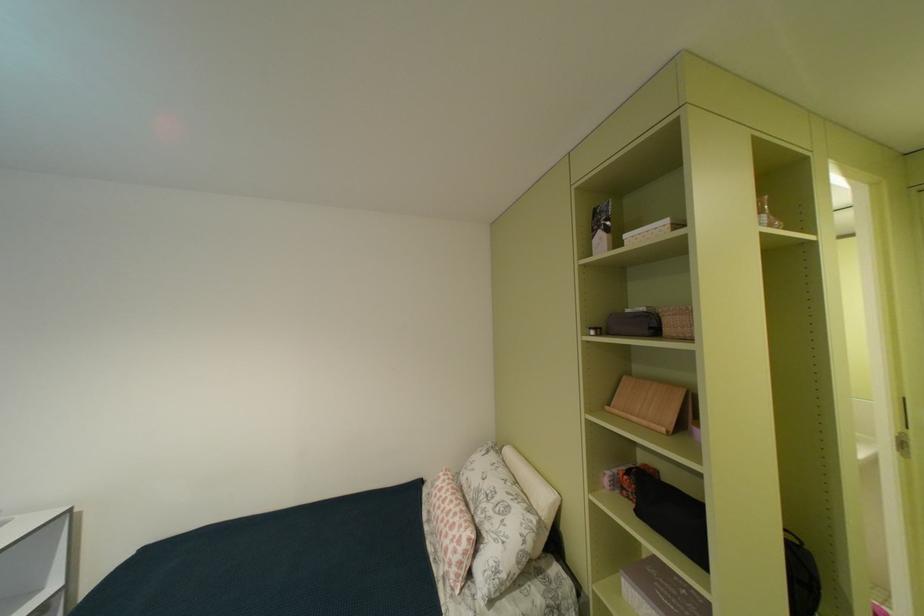
Where is `black fabric pouch`? Image resolution: width=924 pixels, height=616 pixels. black fabric pouch is located at coordinates tap(714, 536).